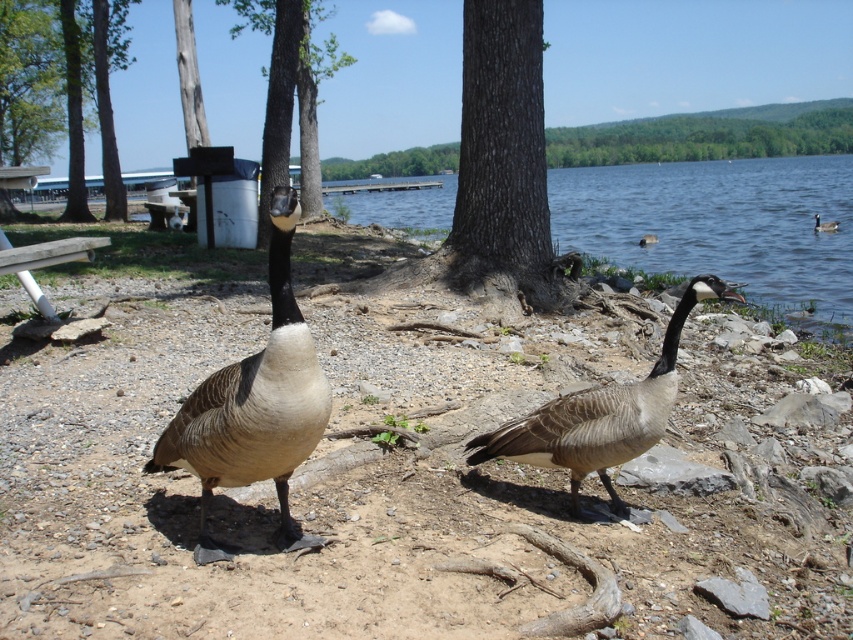
Does brown rough bark tree at center appear over brushed metal trash can at upper left?

Incorrect, brown rough bark tree at center is not positioned above brushed metal trash can at upper left.

Is brown rough bark tree at center thinner than brushed metal trash can at upper left?

Yes.

Find the location of a particular element. brown rough bark tree at center is located at coordinates (502, 160).

Who is taller, brown feathered goose at center or brown feathered duck at center?

With more height is brown feathered goose at center.

Does brown feathered goose at center have a greater height compared to brown feathered duck at center?

Yes, brown feathered goose at center is taller than brown feathered duck at center.

Which is behind, point (303, 432) or point (834, 225)?

The point (834, 225) is behind.

I want to click on brown feathered goose at center, so click(x=254, y=404).

Can you confirm if brown rough bark tree at center is shorter than brown feathered goose at center?

No, brown rough bark tree at center is not shorter than brown feathered goose at center.

Is point (547, 220) positioned after point (306, 380)?

Yes, point (547, 220) is behind point (306, 380).

Where is `brown rough bark tree at center`? This screenshot has width=853, height=640. brown rough bark tree at center is located at coordinates (502, 160).